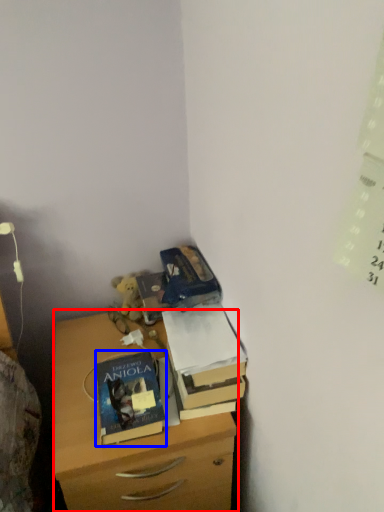
Question: Which object appears farthest to the camera in this image, chest of drawers (highlighted by a red box) or book (highlighted by a blue box)?

Choices:
 (A) chest of drawers
 (B) book

Answer: (B)